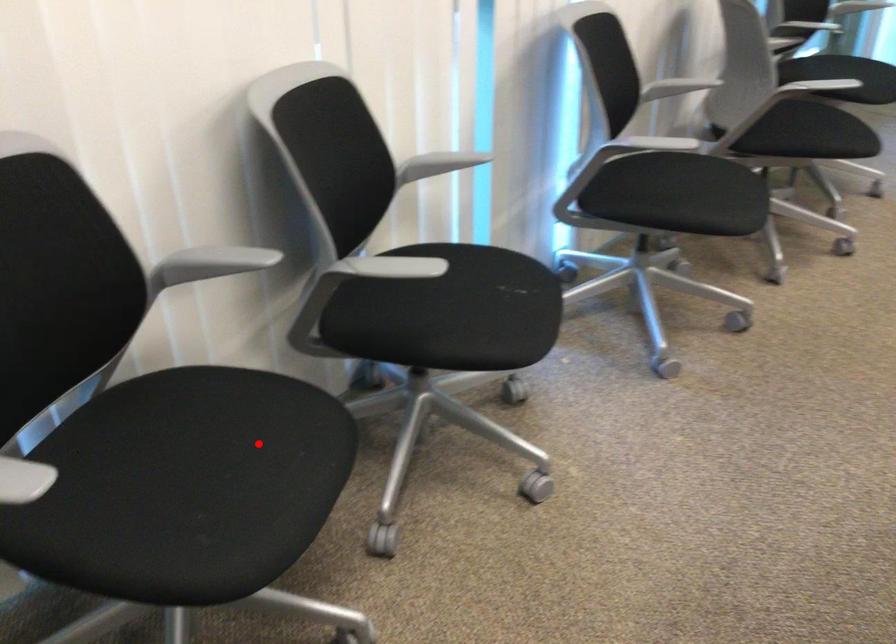
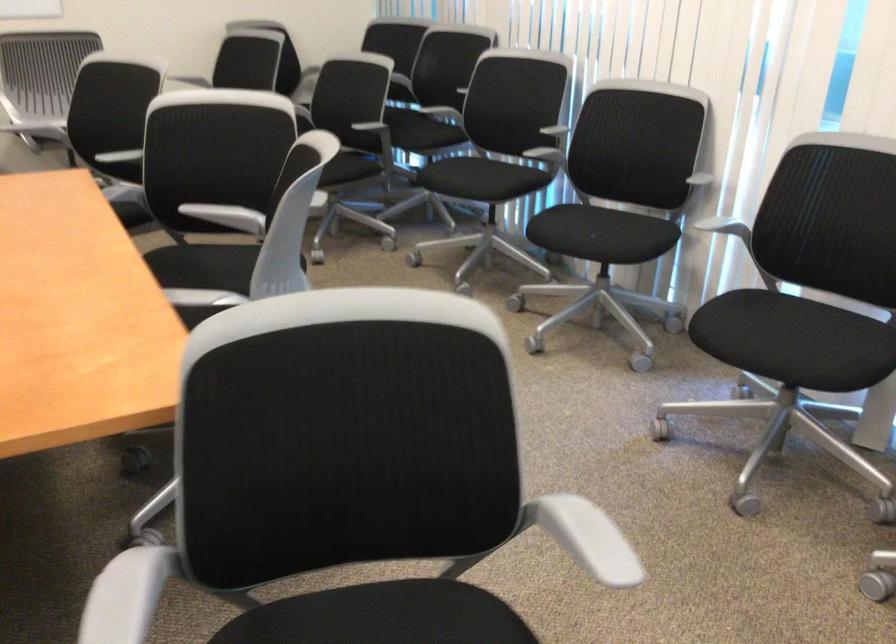
Question: I am providing you with two images of the same scene from different viewpoints. A red point is marked on the first image. At the location where the point appears in image 1, is it still visible in image 2?

Choices:
 (A) Yes
 (B) No

Answer: (A)